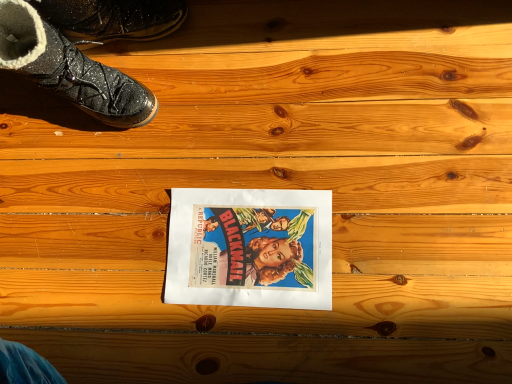
You are a GUI agent. You are given a task and a screenshot of the screen. Output one action in this format:
    pyautogui.click(x=<x>, y=<y>)
    Task: Click on the vacant space that is in between sparkly black boot at upper left, placed as the 2th footwear when sorted from bottom to top, and shiny black boot at upper left, the first footwear in the bottom-to-top sequence
    The image size is (512, 384).
    Given the screenshot: What is the action you would take?
    pyautogui.click(x=151, y=69)